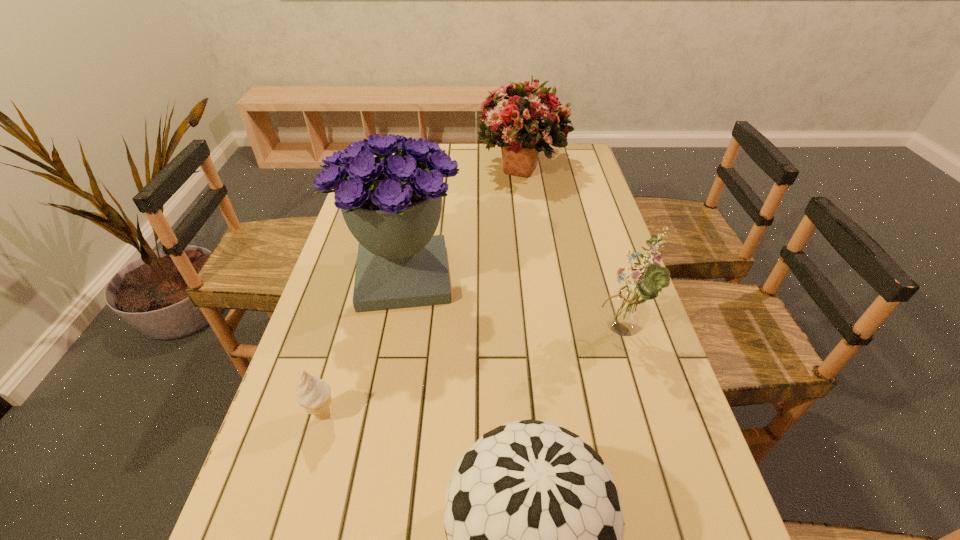
At what (x,y) coordinates should I click in order to perform the action: click on icecream that is at the left edge. Please return your answer as a coordinate pair (x, y). The height and width of the screenshot is (540, 960). Looking at the image, I should click on (314, 396).

In order to click on object that is at the far right corner in this screenshot , I will do `click(525, 120)`.

The image size is (960, 540). Identify the location of vacant space at the far edge. (474, 162).

Image resolution: width=960 pixels, height=540 pixels. Identify the location of free region at the left edge. (307, 364).

This screenshot has width=960, height=540. Identify the location of vacant space at the right edge. (563, 179).

The height and width of the screenshot is (540, 960). What are the coordinates of `free space at the far right corner` in the screenshot? It's located at (556, 165).

In order to click on empty location between the tallest object and the farthest object in this screenshot , I will do `click(462, 221)`.

At what (x,y) coordinates should I click in order to perform the action: click on free space between the tallest bouquet and the farthest object. Please return your answer as a coordinate pair (x, y). The width and height of the screenshot is (960, 540). Looking at the image, I should click on (462, 221).

At what (x,y) coordinates should I click in order to perform the action: click on empty space between the tallest bouquet and the second nearest object. Please return your answer as a coordinate pair (x, y). Image resolution: width=960 pixels, height=540 pixels. Looking at the image, I should click on (x=364, y=345).

Select which object is the closest to the tallest object. Please provide its 2D coordinates. Your answer should be formatted as a tuple, i.e. [(x, y)], where the tuple contains the x and y coordinates of a point satisfying the conditions above.

[(314, 396)]